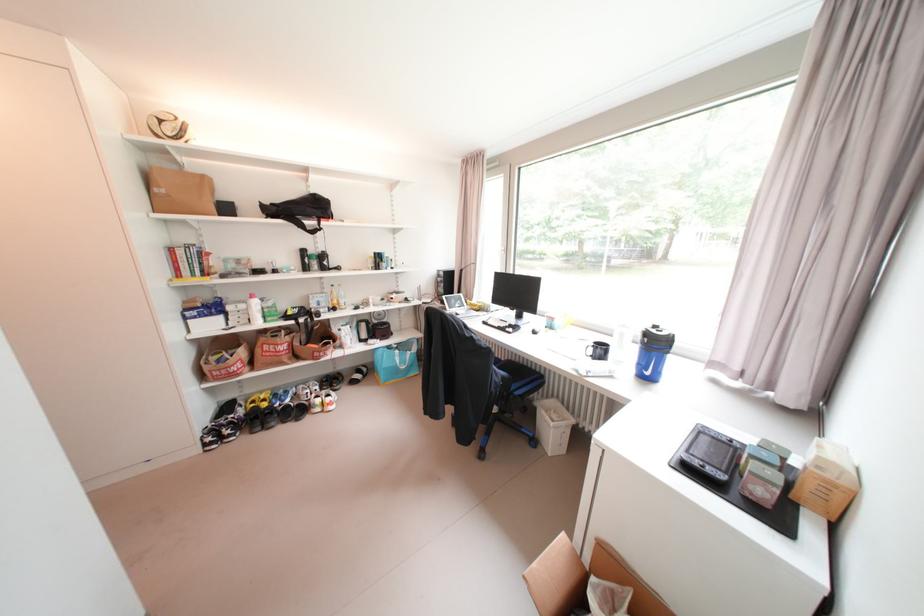
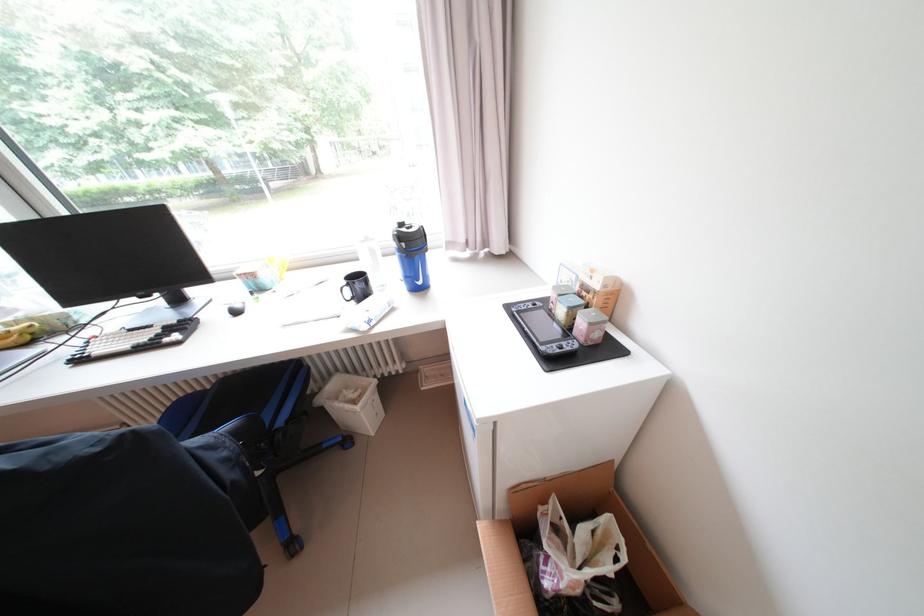
Locate, in the second image, the point that corresponds to point 485,302 in the first image.

(15, 326)